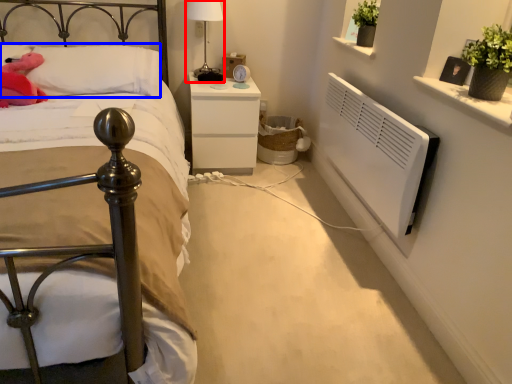
Question: Which of the following is the farthest to the observer, bedside lamp (highlighted by a red box) or pillow (highlighted by a blue box)?

Choices:
 (A) bedside lamp
 (B) pillow

Answer: (A)